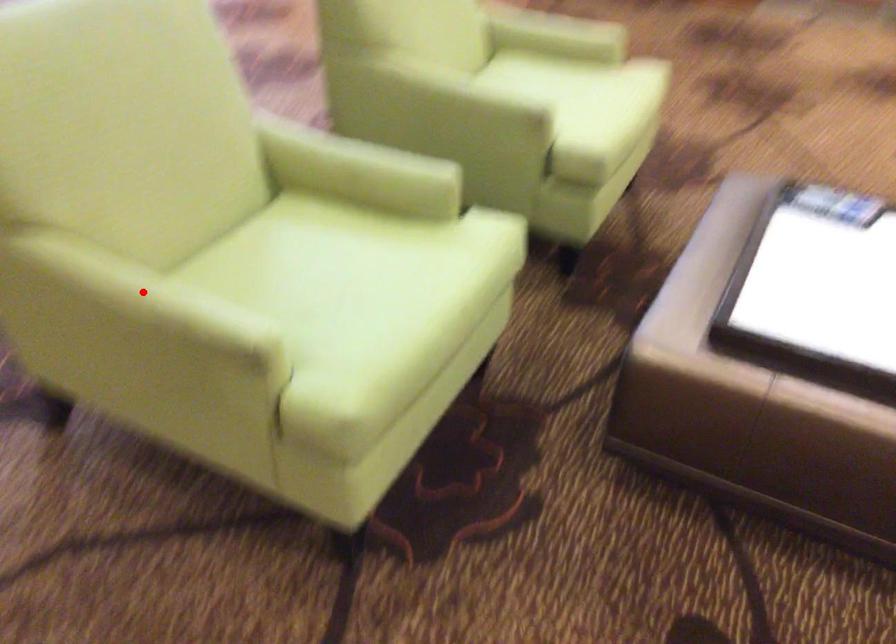
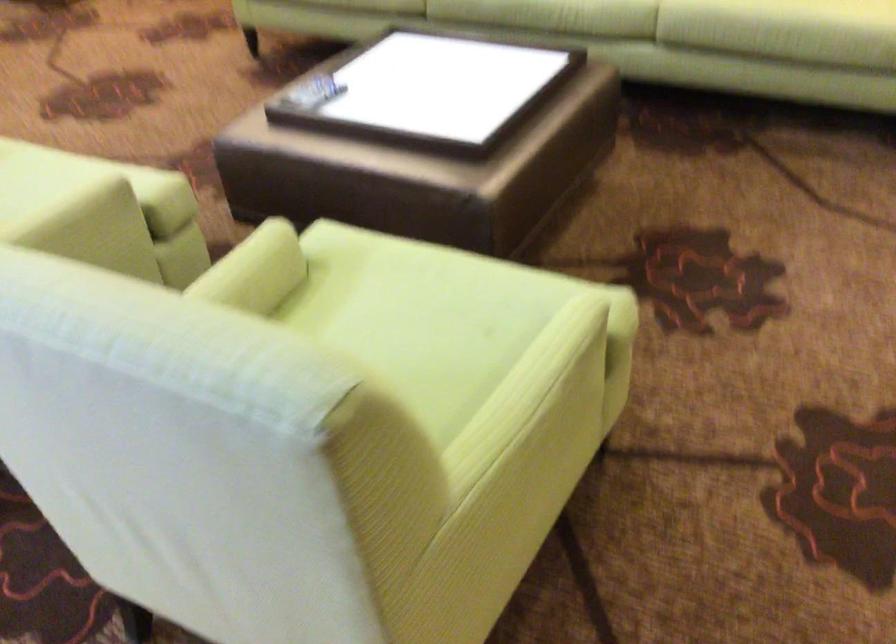
Locate, in the second image, the point that corresponds to the highlighted location in the first image.

(528, 393)